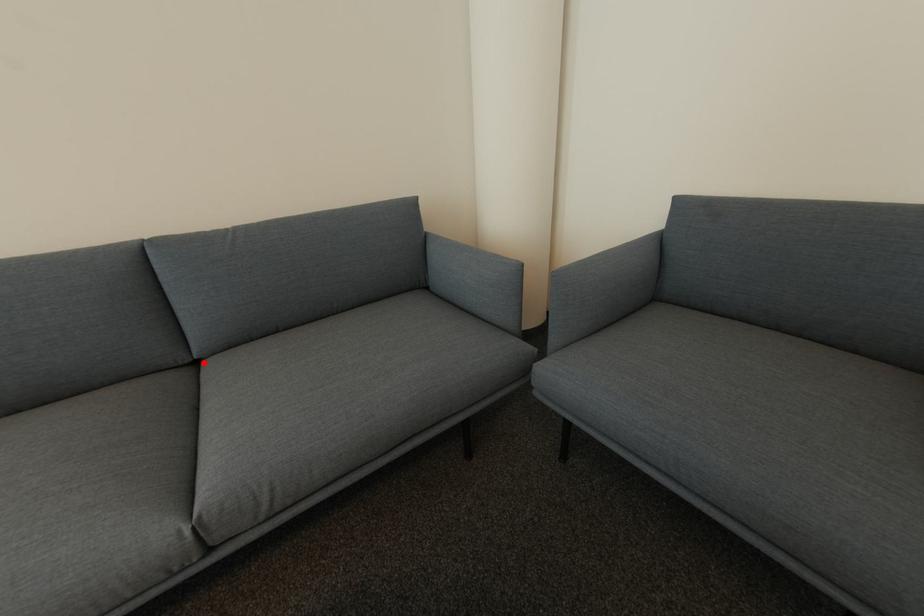
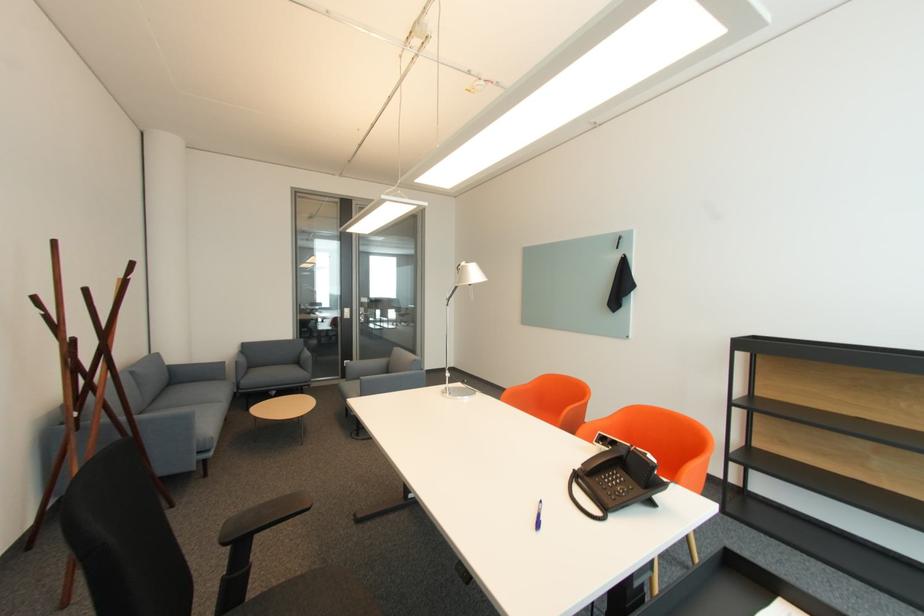
Question: I am providing you with two images of the same scene from different viewpoints. Given a red point in image1, look at the same physical point in image2. Is it:

Choices:
 (A) Closer to the viewpoint
 (B) Farther from the viewpoint

Answer: (B)